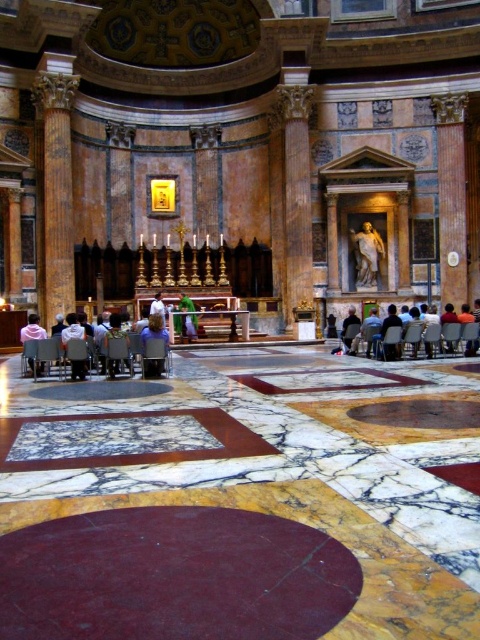
You are standing at the entrance of the Pantheon and want to sit on the matte black chair at center. Which direction should you move to reach it?

You should move forward towards the center of the Pantheon to reach the matte black chair at center located at point coordinates [154,356].